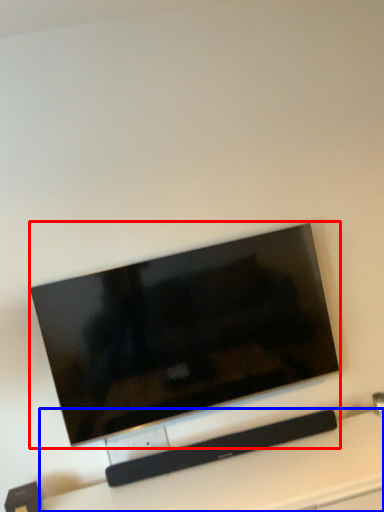
Question: Which object is further to the camera taking this photo, television (highlighted by a red box) or furniture (highlighted by a blue box)?

Choices:
 (A) television
 (B) furniture

Answer: (A)